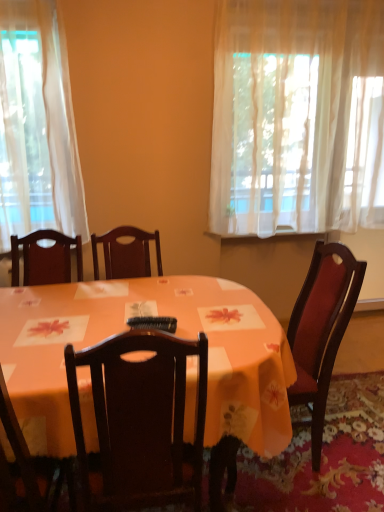
Question: Considering the relative sizes of sheer white curtain at upper right and black plastic remote control at center in the image provided, is sheer white curtain at upper right smaller than black plastic remote control at center?

Choices:
 (A) yes
 (B) no

Answer: (B)

Question: Does sheer white curtain at upper right appear on the right side of black plastic remote control at center?

Choices:
 (A) no
 (B) yes

Answer: (B)

Question: Could you tell me if sheer white curtain at upper right is facing black plastic remote control at center?

Choices:
 (A) yes
 (B) no

Answer: (B)

Question: Is sheer white curtain at upper right facing away from black plastic remote control at center?

Choices:
 (A) yes
 (B) no

Answer: (B)

Question: Is sheer white curtain at upper right bigger than black plastic remote control at center?

Choices:
 (A) no
 (B) yes

Answer: (B)

Question: Is sheer white curtain at upper right inside the boundaries of wooden chair at lower left, or outside?

Choices:
 (A) outside
 (B) inside

Answer: (A)

Question: Looking at the image, does sheer white curtain at upper right seem bigger or smaller compared to wooden chair at lower left?

Choices:
 (A) big
 (B) small

Answer: (A)

Question: In the image, is sheer white curtain at upper right positioned in front of or behind wooden chair at lower left?

Choices:
 (A) behind
 (B) front

Answer: (A)

Question: Based on their positions, is sheer white curtain at upper right located to the left or right of wooden chair at lower left?

Choices:
 (A) left
 (B) right

Answer: (B)

Question: Is sheer white curtain at upper right bigger or smaller than orange fabric table at center?

Choices:
 (A) small
 (B) big

Answer: (A)

Question: Is sheer white curtain at upper right taller or shorter than orange fabric table at center?

Choices:
 (A) short
 (B) tall

Answer: (B)

Question: Choose the correct answer: Is sheer white curtain at upper right inside orange fabric table at center or outside it?

Choices:
 (A) outside
 (B) inside

Answer: (A)

Question: In terms of width, does sheer white curtain at upper right look wider or thinner when compared to orange fabric table at center?

Choices:
 (A) wide
 (B) thin

Answer: (B)

Question: Relative to orange fabric table at center, is wooden chair at lower left in front or behind?

Choices:
 (A) front
 (B) behind

Answer: (A)

Question: From the image's perspective, is wooden chair at lower left positioned above or below orange fabric table at center?

Choices:
 (A) above
 (B) below

Answer: (B)